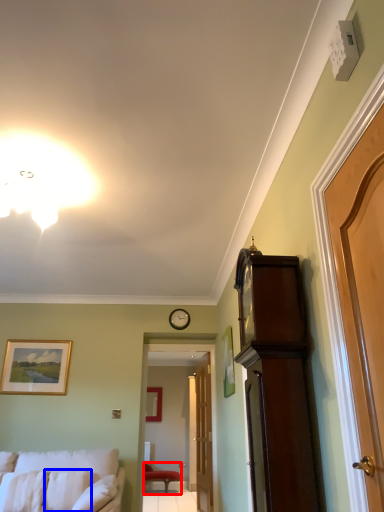
Question: Which point is further to the camera, chair (highlighted by a red box) or pillow (highlighted by a blue box)?

Choices:
 (A) chair
 (B) pillow

Answer: (A)